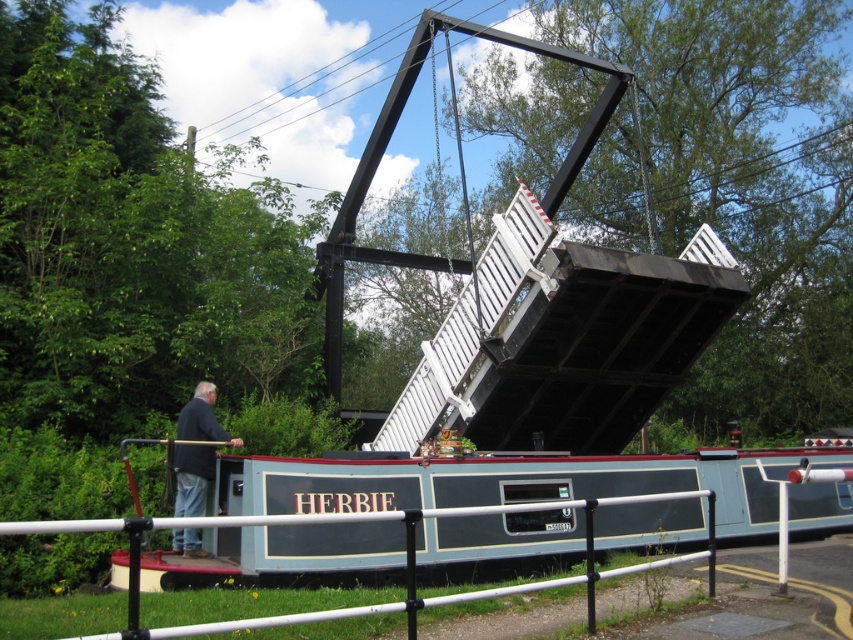
Which is behind, point (434, 605) or point (196, 452)?

Point (196, 452)

Is white metal rail at lower center below dark blue jacket at lower left?

Indeed, white metal rail at lower center is positioned under dark blue jacket at lower left.

Between point (178, 625) and point (173, 506), which one is positioned in front?

Positioned in front is point (178, 625).

Image resolution: width=853 pixels, height=640 pixels. In order to click on white metal rail at lower center in this screenshot , I will do `click(453, 593)`.